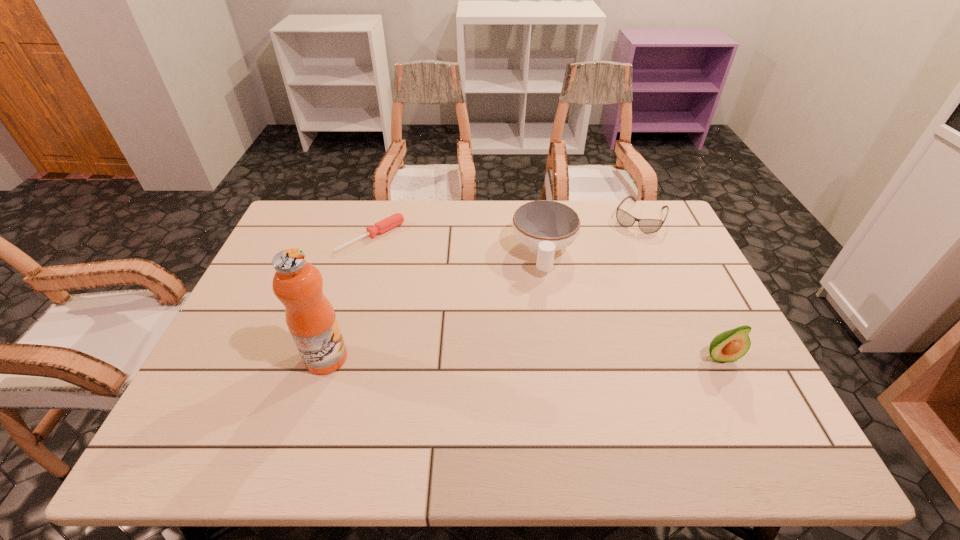
Where is `blank region between the avocado and the second shortest object`? The width and height of the screenshot is (960, 540). blank region between the avocado and the second shortest object is located at coordinates [x=680, y=287].

Find the location of a particular element. empty location between the third object from left to right and the avocado is located at coordinates tap(632, 305).

This screenshot has width=960, height=540. I want to click on vacant space that's between the second shortest object and the tallest object, so click(x=483, y=288).

This screenshot has width=960, height=540. In order to click on vacant area that lies between the tallest object and the shortest object in this screenshot , I will do [x=349, y=298].

Locate an element on the screen. The height and width of the screenshot is (540, 960). empty space that is in between the sunglasses and the screwdriver is located at coordinates (506, 227).

Where is `empty space between the tallest object and the third tallest object`? This screenshot has width=960, height=540. empty space between the tallest object and the third tallest object is located at coordinates (435, 305).

Locate an element on the screen. The height and width of the screenshot is (540, 960). vacant region between the avocado and the third object from left to right is located at coordinates (632, 305).

The height and width of the screenshot is (540, 960). I want to click on empty location between the chinaware and the screwdriver, so click(458, 245).

The width and height of the screenshot is (960, 540). Find the location of `object that stands as the fourth closest to the fruit juice`. object that stands as the fourth closest to the fruit juice is located at coordinates (648, 226).

Locate an element on the screen. the closest object to the tallest object is located at coordinates (396, 219).